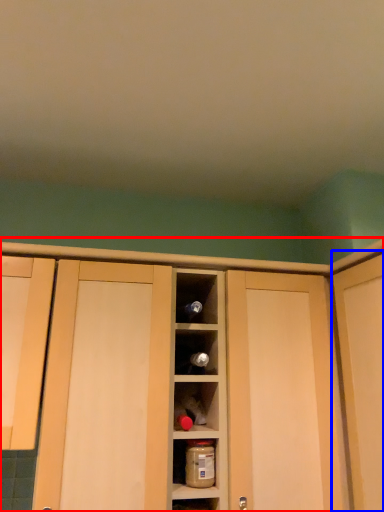
Question: Which object is further to the camera taking this photo, cabinetry (highlighted by a red box) or door (highlighted by a blue box)?

Choices:
 (A) cabinetry
 (B) door

Answer: (A)